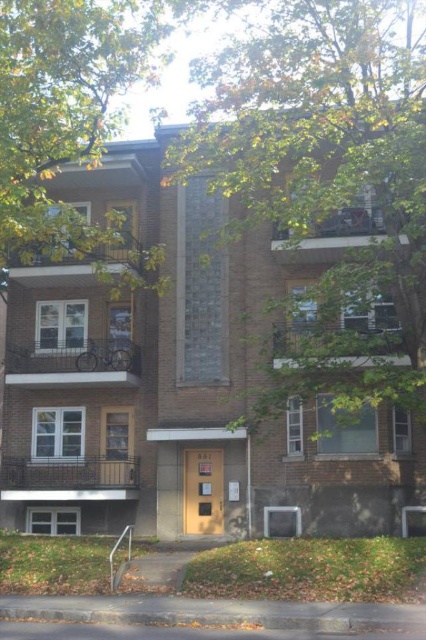
Is point (389, 276) positioned after point (166, 28)?

That is False.

Looking at this image, who is higher up, green leafy tree at upper center or green leafy tree at upper left?

green leafy tree at upper left is above.

I want to click on green leafy tree at upper center, so click(x=328, y=184).

Find the location of a particular element. The width and height of the screenshot is (426, 640). green leafy tree at upper center is located at coordinates (328, 184).